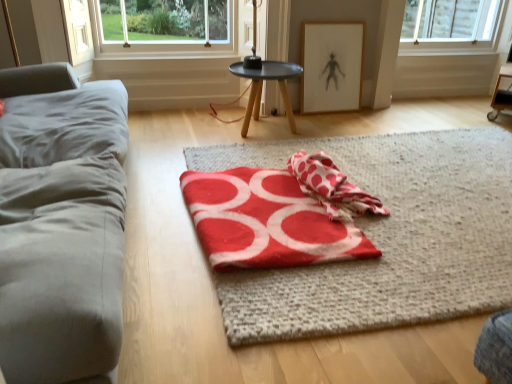
Image resolution: width=512 pixels, height=384 pixels. I want to click on free location to the right of red polka dot towel at center, the 2th beach towel when ordered from left to right, so click(422, 200).